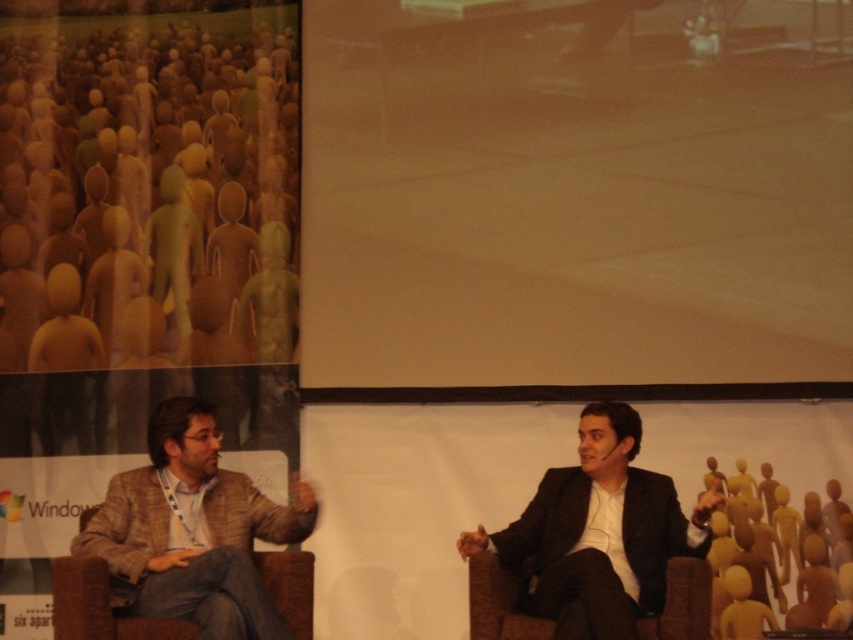
Is point (612, 458) positioned before point (494, 609)?

No, (612, 458) is further to viewer.

What do you see at coordinates (598, 532) in the screenshot?
I see `black suit at center` at bounding box center [598, 532].

I want to click on black suit at center, so click(x=598, y=532).

Identify the location of black suit at center. (598, 532).

Is plaid wool blazer at left smaller than brown fabric chair at lower right?

No.

Between plaid wool blazer at left and brown fabric chair at lower right, which one is positioned higher?

Positioned higher is plaid wool blazer at left.

Identify the location of plaid wool blazer at left. This screenshot has height=640, width=853. (192, 531).

Which is more to the left, matte white screen at center or black suit at center?

Positioned to the left is matte white screen at center.

Between point (306, 312) and point (592, 582), which one is positioned in front?

Point (592, 582) is more forward.

The width and height of the screenshot is (853, 640). I want to click on matte white screen at center, so click(576, 198).